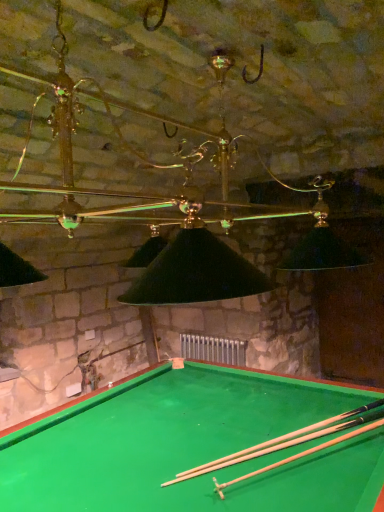
The image size is (384, 512). Describe the element at coordinates (287, 440) in the screenshot. I see `light brown wood cue at bottom right` at that location.

Where is `light brown wood cue at bottom right`? The width and height of the screenshot is (384, 512). light brown wood cue at bottom right is located at coordinates (287, 440).

Find the location of a particular element. The height and width of the screenshot is (512, 384). light brown wood cue at bottom right is located at coordinates click(287, 440).